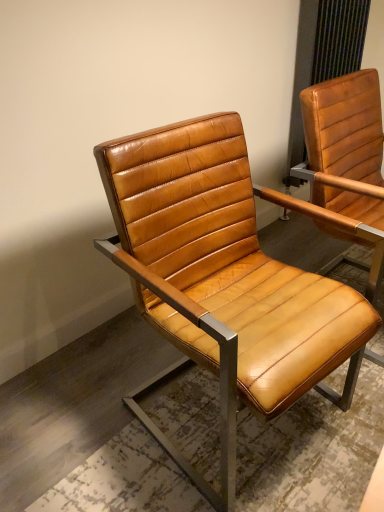
At what (x,y) coordinates should I click in order to perform the action: click on vacant space to the left of cognac leather chair at center, positioned as the 2th chair in right-to-left order. Please return your answer as a coordinate pair (x, y). Looking at the image, I should click on (90, 414).